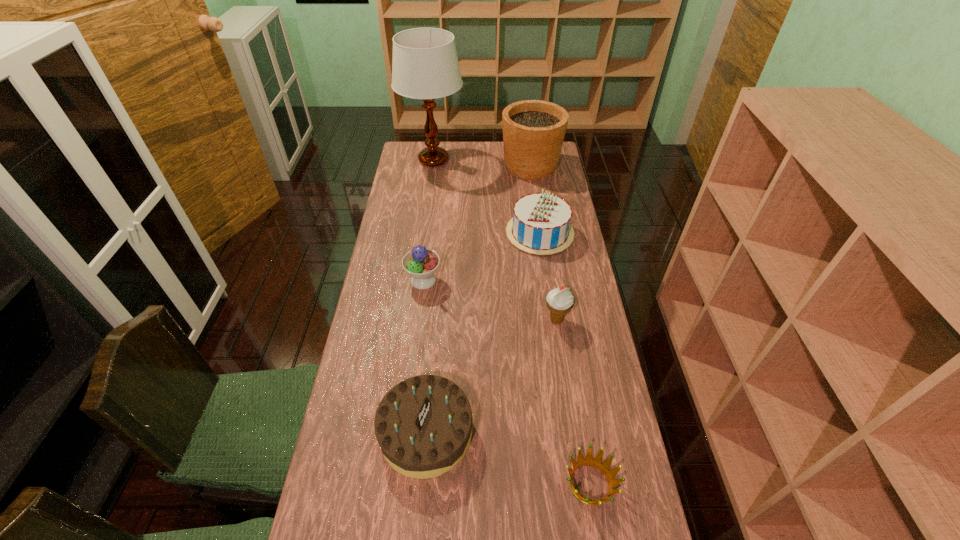
The height and width of the screenshot is (540, 960). What are the coordinates of `vacant area at the right edge of the desktop` in the screenshot? It's located at point(605,423).

The height and width of the screenshot is (540, 960). Identify the location of free space at the far left corner. (418, 143).

Where is `vacant space that's between the crown and the nearer birthday cake`? vacant space that's between the crown and the nearer birthday cake is located at coordinates (508, 458).

Locate an element on the screen. Image resolution: width=960 pixels, height=540 pixels. free spot between the sixth tallest object and the right icecream is located at coordinates (492, 376).

Where is `unoccupied area between the sixth tallest object and the shortest object`? unoccupied area between the sixth tallest object and the shortest object is located at coordinates (508, 458).

Find the location of a particular element. vacant area that lies between the third nearest object and the fifth nearest object is located at coordinates (548, 276).

Locate an element on the screen. The image size is (960, 540). empty space that is in between the third nearest object and the left birthday cake is located at coordinates (492, 376).

I want to click on vacant space that's between the shorter birthday cake and the left icecream, so click(x=424, y=356).

At what (x,y) coordinates should I click in order to perform the action: click on vacant point located between the farther icecream and the shorter birthday cake. Please return your answer as a coordinate pair (x, y). The image size is (960, 540). Looking at the image, I should click on (424, 356).

Image resolution: width=960 pixels, height=540 pixels. What are the coordinates of `object that ranks as the closest to the shortest object` in the screenshot? It's located at (423, 425).